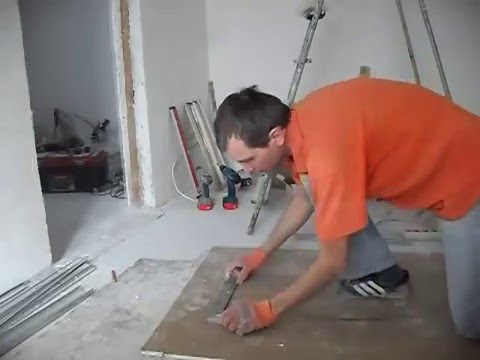
In order to click on floor in this screenshot , I will do `click(183, 238)`.